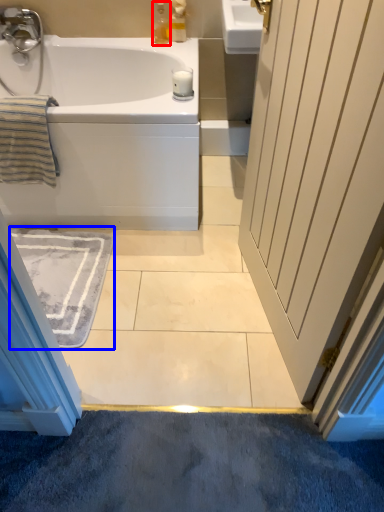
Question: Which point is closer to the camera, soap dispenser (highlighted by a red box) or bath mat (highlighted by a blue box)?

Choices:
 (A) soap dispenser
 (B) bath mat

Answer: (B)